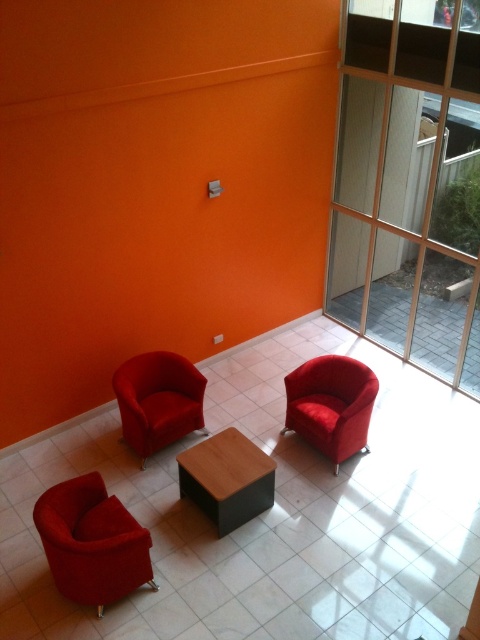
Question: Estimate the real-world distances between objects in this image. Which object is farther from the velvet red armchair at lower left?

Choices:
 (A) transparent glass door at upper right
 (B) matte red armchair at center

Answer: (A)

Question: Observing the image, what is the correct spatial positioning of transparent glass door at upper right in reference to matte red armchair at center?

Choices:
 (A) right
 (B) left

Answer: (A)

Question: Does transparent glass door at upper right have a smaller size compared to matte red armchair at center?

Choices:
 (A) no
 (B) yes

Answer: (A)

Question: Which of the following is the farthest from the observer?

Choices:
 (A) (215, 513)
 (B) (409, 243)

Answer: (B)

Question: From the image, what is the correct spatial relationship of transparent glass door at upper right in relation to velvet red armchair at center?

Choices:
 (A) left
 (B) right

Answer: (B)

Question: Estimate the real-world distances between objects in this image. Which object is farther from the velvet red armchair at center?

Choices:
 (A) transparent glass door at upper right
 (B) velvet red armchair at lower left

Answer: (A)